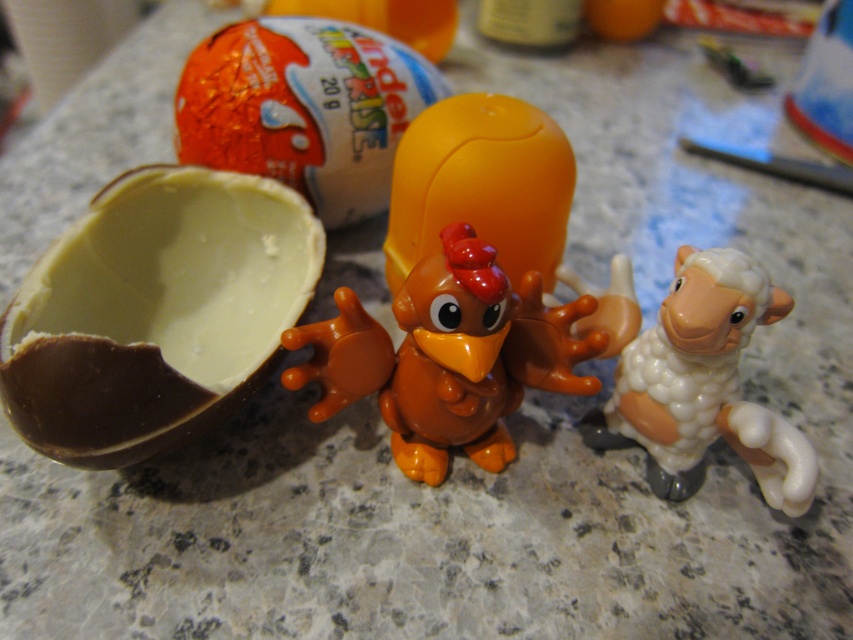
Image resolution: width=853 pixels, height=640 pixels. Describe the element at coordinates (155, 312) in the screenshot. I see `smooth chocolate egg at center` at that location.

Does smooth chocolate egg at center appear under orange matte plastic chicken at center?

Actually, smooth chocolate egg at center is above orange matte plastic chicken at center.

Which is in front, point (270, 228) or point (538, 372)?

Point (538, 372) is in front.

Where is `smooth chocolate egg at center`? This screenshot has height=640, width=853. smooth chocolate egg at center is located at coordinates (155, 312).

Who is higher up, orange matte plastic chicken at center or white glossy sheep at right?

orange matte plastic chicken at center is above.

Can you confirm if orange matte plastic chicken at center is positioned to the right of white glossy sheep at right?

No, orange matte plastic chicken at center is not to the right of white glossy sheep at right.

Is point (471, 337) farther from camera compared to point (759, 428)?

No, (471, 337) is in front of (759, 428).

The image size is (853, 640). Find the location of `orange matte plastic chicken at center`. orange matte plastic chicken at center is located at coordinates pyautogui.click(x=447, y=356).

Locate an element on the screen. smooth chocolate egg at center is located at coordinates (155, 312).

Can you confirm if smooth chocolate egg at center is taller than white glossy sheep at right?

Correct, smooth chocolate egg at center is much taller as white glossy sheep at right.

Is point (231, 352) farther from viewer compared to point (635, 349)?

That is True.

Locate an element on the screen. This screenshot has height=640, width=853. smooth chocolate egg at center is located at coordinates (155, 312).